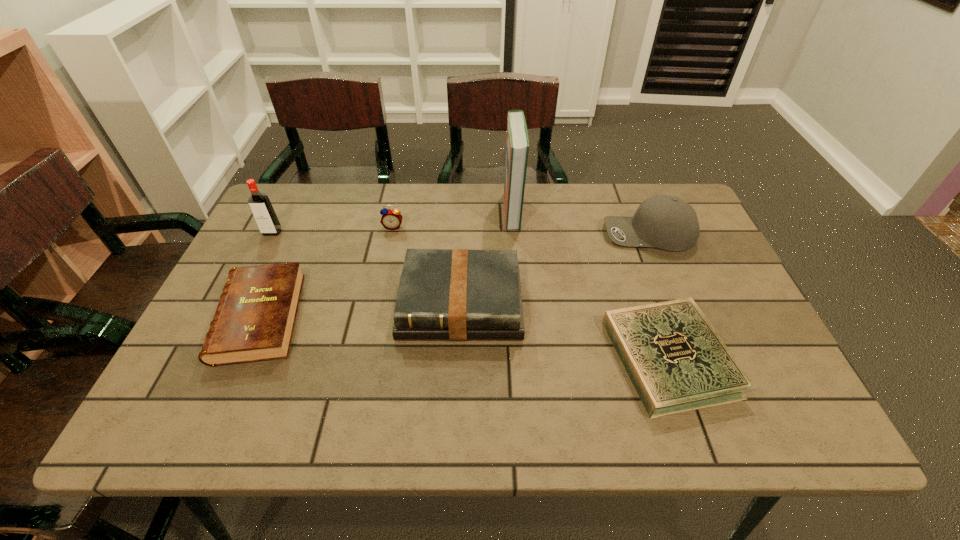
You are a GUI agent. You are given a task and a screenshot of the screen. Output one action in this format:
    pyautogui.click(x=<x>, y=<y>)
    Task: Click on the object situated at the far left corner
    The image size is (960, 540).
    Given the screenshot: What is the action you would take?
    pyautogui.click(x=260, y=205)

Find the location of a particular element. The width and height of the screenshot is (960, 540). object located in the far right corner section of the desktop is located at coordinates (666, 222).

Where is `object that is at the near right corner`? object that is at the near right corner is located at coordinates (676, 361).

In the image, there is a desktop. Where is `vacant space at the far edge`? The image size is (960, 540). vacant space at the far edge is located at coordinates (345, 230).

Image resolution: width=960 pixels, height=540 pixels. In order to click on vacant space at the near edge of the desktop in this screenshot , I will do `click(447, 427)`.

Find the location of `vacant area at the left edge`. vacant area at the left edge is located at coordinates (298, 254).

At what (x,y) coordinates should I click in order to perform the action: click on free region at the right edge of the desktop. Please return your answer as a coordinate pair (x, y). Looking at the image, I should click on (765, 345).

In the image, there is a desktop. Identify the location of vacant space at the far left corner. (294, 219).

Find the location of `vacant space at the far right corner of the desktop`. vacant space at the far right corner of the desktop is located at coordinates (x=704, y=232).

Find the location of a particular element. Image resolution: width=960 pixels, height=540 pixels. free point between the third object from left to right and the vodka is located at coordinates (333, 230).